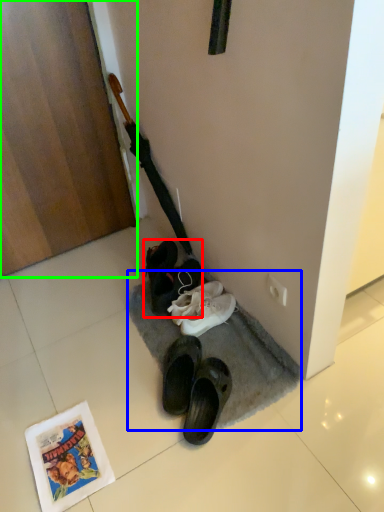
Question: Estimate the real-world distances between objects in this image. Which object is closer to footwear (highlighted by a red box), doormat (highlighted by a blue box) or door (highlighted by a green box)?

Choices:
 (A) doormat
 (B) door

Answer: (A)